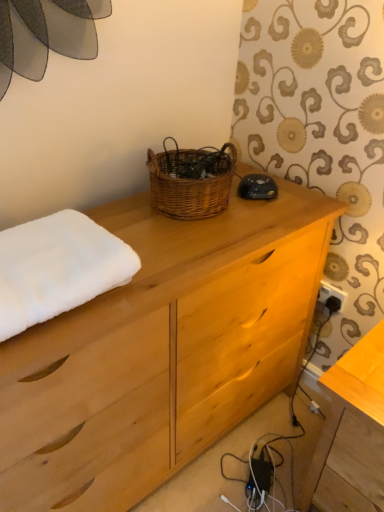
You are a GUI agent. You are given a task and a screenshot of the screen. Output one action in this format:
    pyautogui.click(x=<x>, y=<y>)
    Task: Click on the vacant space that is to the left of woven brown basket at center
    Image resolution: width=384 pixels, height=512 pixels.
    Given the screenshot: What is the action you would take?
    pyautogui.click(x=128, y=213)